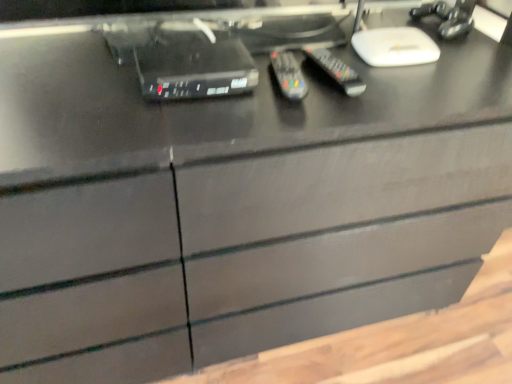
You are a GUI agent. You are given a task and a screenshot of the screen. Output one action in this format:
    pyautogui.click(x=<x>, y=<y>)
    Task: Click on the vacant space in front of black plastic remote at center, placed as the 1th control when sorted from left to right
    This screenshot has width=512, height=384.
    Given the screenshot: What is the action you would take?
    pyautogui.click(x=273, y=116)